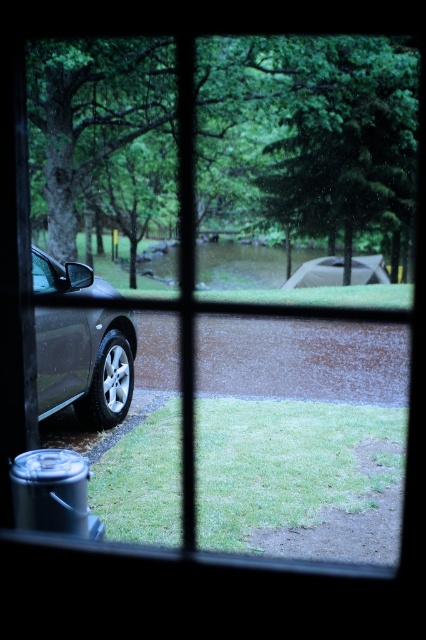
Which is more to the right, green leafy tree at upper center or matte black car at left?

Positioned to the right is green leafy tree at upper center.

Which is behind, point (403, 61) or point (80, 385)?

The point (403, 61) is behind.

Identify the location of green leafy tree at upper center. (345, 140).

Who is taller, green leafy tree at upper left or green leafy tree at upper center?

With more height is green leafy tree at upper center.

Is point (62, 216) closer to camera compared to point (411, 202)?

Yes, point (62, 216) is in front of point (411, 202).

Is point (215, 70) positioned in front of point (331, 237)?

Yes, point (215, 70) is in front of point (331, 237).

You are a GUI agent. You are given a task and a screenshot of the screen. Output one action in this format:
    pyautogui.click(x=<x>, y=<y>)
    Task: Click on the green leafy tree at upper left
    
    Given the screenshot: What is the action you would take?
    pyautogui.click(x=307, y=131)

Is green leafy tree at upper left smaller than matte black car at left?

Indeed, green leafy tree at upper left has a smaller size compared to matte black car at left.

Is green leafy tree at upper left thinner than matte black car at left?

In fact, green leafy tree at upper left might be wider than matte black car at left.

Who is more distant from viewer, (324, 93) or (86, 333)?

The point (324, 93) is more distant.

The image size is (426, 640). In order to click on green leafy tree at upper left in this screenshot , I will do (x=307, y=131).